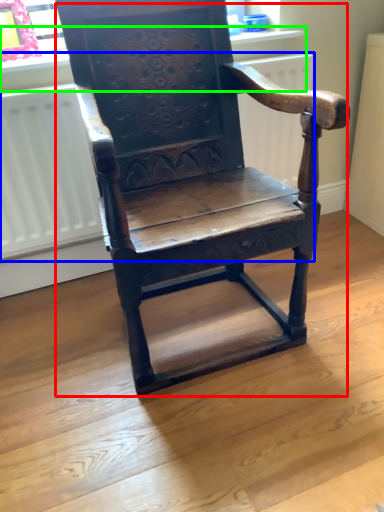
Question: Which object is the closest to the chair (highlighted by a red box)? Choose among these: radiator (highlighted by a blue box) or window sill (highlighted by a green box).

Choices:
 (A) radiator
 (B) window sill

Answer: (A)